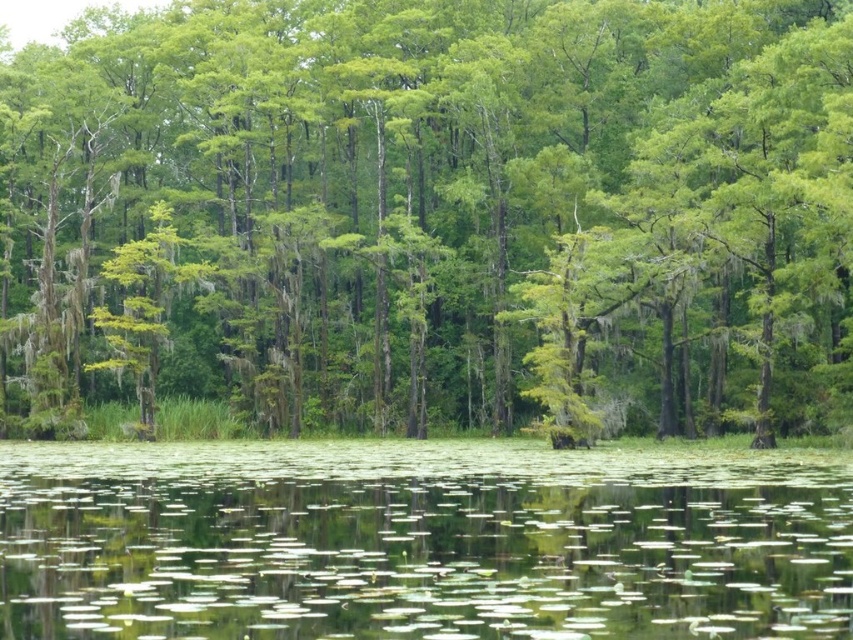
Question: Which point is closer to the camera taking this photo?

Choices:
 (A) (567, 397)
 (B) (502, 486)

Answer: (B)

Question: Is green mossy tree at center positioned in front of green lily pads at center?

Choices:
 (A) yes
 (B) no

Answer: (B)

Question: Can you confirm if green mossy tree at center is positioned to the left of green lily pads at center?

Choices:
 (A) yes
 (B) no

Answer: (A)

Question: Which point is closer to the camera taking this photo?

Choices:
 (A) (259, 634)
 (B) (421, 224)

Answer: (A)

Question: Can you confirm if green mossy tree at center is thinner than green lily pads at center?

Choices:
 (A) yes
 (B) no

Answer: (B)